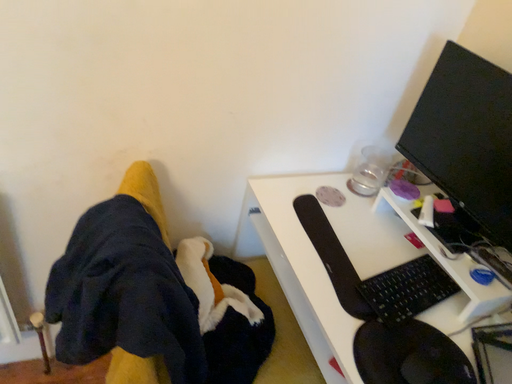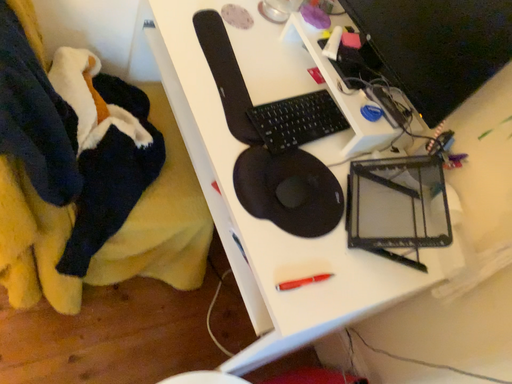
Question: Which way did the camera rotate in the video?

Choices:
 (A) rotated upward
 (B) rotated downward

Answer: (B)